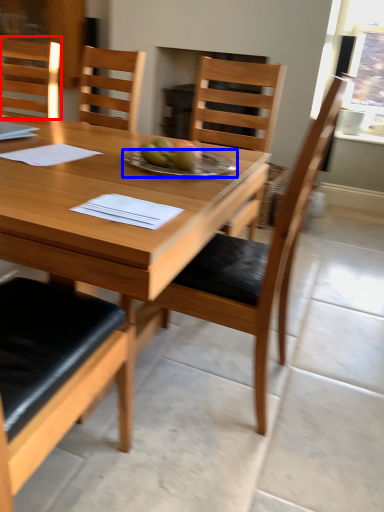
Question: Which point is further to the camera, chair (highlighted by a red box) or plate (highlighted by a blue box)?

Choices:
 (A) chair
 (B) plate

Answer: (A)